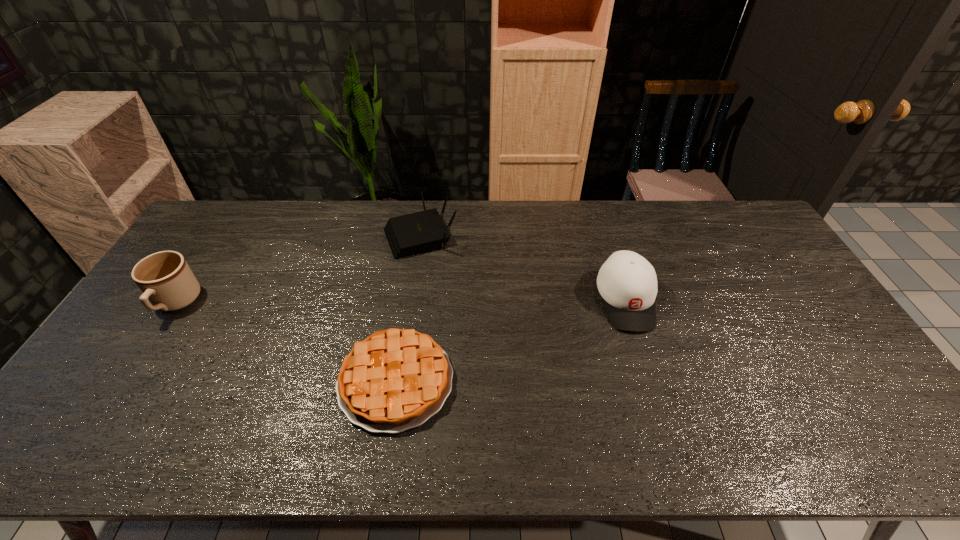
Identify the location of blank space that satisfies the following two spatial constraints: 1. on the side of the mug with the handle; 2. on the right side of the nearest object. This screenshot has width=960, height=540. (125, 381).

You are a GUI agent. You are given a task and a screenshot of the screen. Output one action in this format:
    pyautogui.click(x=<x>, y=<y>)
    Task: Click on the free space that satisfies the following two spatial constraints: 1. on the side of the pie with the handle; 2. on the left side of the leftmost object
    The image size is (960, 540).
    Given the screenshot: What is the action you would take?
    pyautogui.click(x=125, y=381)

Identify the location of vacant point that satisfies the following two spatial constraints: 1. on the side of the mug with the handle; 2. on the right side of the nearest object. (125, 381).